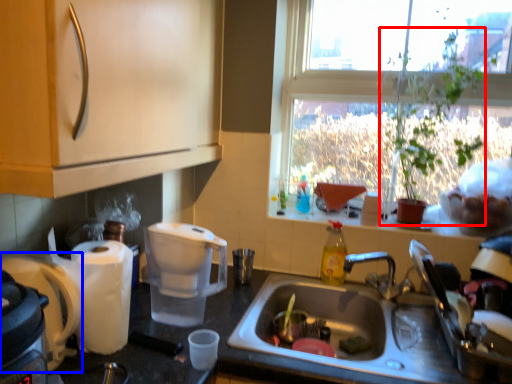
Question: Which of the following is the closest to the observer, houseplant (highlighted by a red box) or coffee maker (highlighted by a blue box)?

Choices:
 (A) houseplant
 (B) coffee maker

Answer: (B)